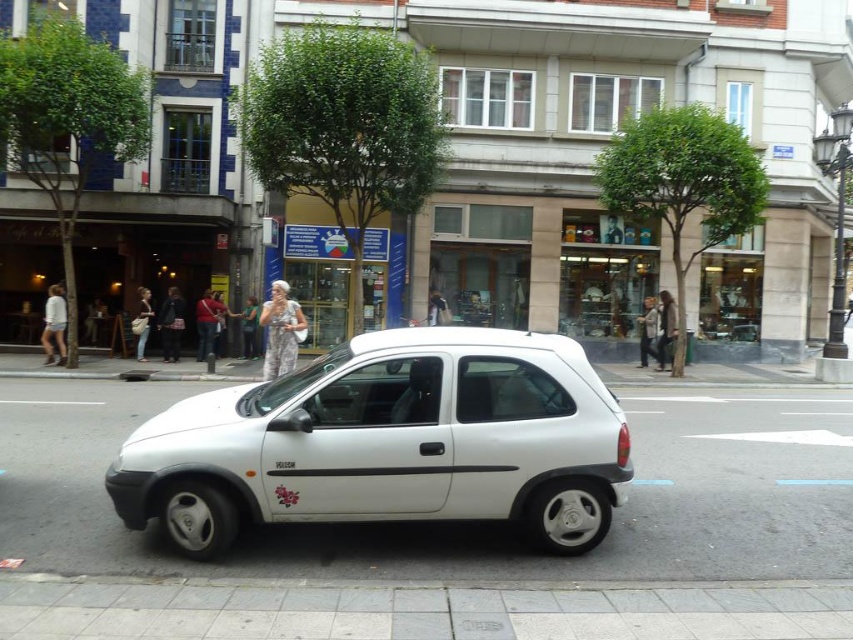
Question: Can you confirm if white matte pavement at center is thinner than light beige fabric dress at center?

Choices:
 (A) yes
 (B) no

Answer: (B)

Question: Which point appears closest to the camera in this image?

Choices:
 (A) pos(62,310)
 (B) pos(758,452)

Answer: (B)

Question: Which of the following is the closest to the observer?

Choices:
 (A) white matte pavement at center
 (B) red shirt at center
 (C) denim jacket at center

Answer: (A)

Question: Is dark brown leather jacket at center to the right of denim jacket at center from the viewer's perspective?

Choices:
 (A) yes
 (B) no

Answer: (A)

Question: Which point is closer to the camera?

Choices:
 (A) denim jacket at center
 (B) camouflage-patterned dress at center
 (C) white matte pavement at center
 (D) red shirt at center

Answer: (C)

Question: Does camouflage-patterned dress at center have a larger size compared to white fabric dress at center?

Choices:
 (A) no
 (B) yes

Answer: (B)